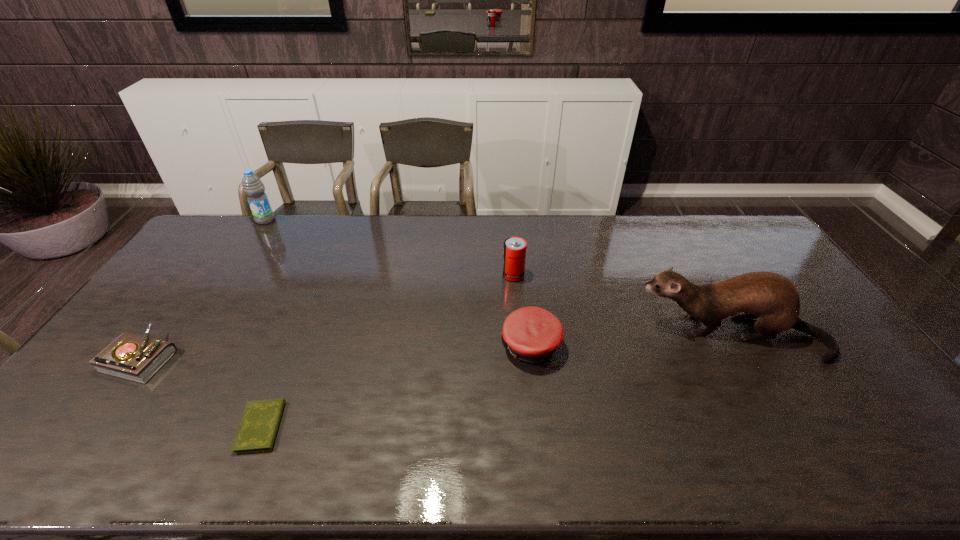
This screenshot has width=960, height=540. Find the location of `object at the near edge`. object at the near edge is located at coordinates (258, 427).

Where is `object at the left edge`? object at the left edge is located at coordinates (133, 357).

Identify the location of object that is at the right edge. Image resolution: width=960 pixels, height=540 pixels. (772, 299).

You are a GUI agent. You are given a task and a screenshot of the screen. Output one action in this format:
    pyautogui.click(x=<x>, y=<y>)
    Task: Click on the free spot at the far edge of the desktop
    This screenshot has width=960, height=540.
    Given the screenshot: What is the action you would take?
    pyautogui.click(x=465, y=219)

This screenshot has width=960, height=540. Identify the location of vacant space at the near edge of the desktop. (137, 466).

This screenshot has width=960, height=540. Identify the location of free location at the left edge. (94, 405).

Where is `free spot at the right edge of the desktop`? The width and height of the screenshot is (960, 540). free spot at the right edge of the desktop is located at coordinates (909, 431).

This screenshot has width=960, height=540. What are the coordinates of `vacant space at the far right corner of the desktop` in the screenshot? It's located at (746, 238).

Locate an element on the screen. The image size is (960, 540). vacant region between the rightmost object and the cap is located at coordinates (631, 340).

Identify the location of unoccupied area between the second shortest object and the second farthest object. This screenshot has width=960, height=540. (327, 316).